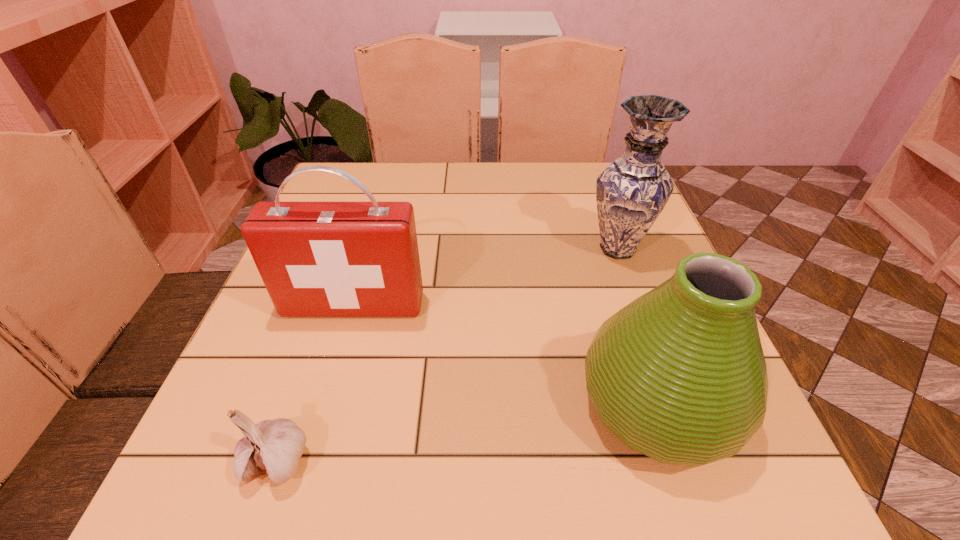
I want to click on the first-aid kit at the left edge, so click(317, 259).

Where is `garlic at the left edge`? The width and height of the screenshot is (960, 540). garlic at the left edge is located at coordinates (274, 447).

This screenshot has height=540, width=960. Identify the location of object situated at the near left corner. (274, 447).

Where is `object that is at the near right corner`? This screenshot has height=540, width=960. object that is at the near right corner is located at coordinates (679, 374).

In the image, there is a desktop. What are the coordinates of `vacant space at the far edge` in the screenshot? It's located at (394, 168).

You are a GUI agent. You are given a task and a screenshot of the screen. Output one action in this format:
    pyautogui.click(x=<x>, y=<y>)
    Task: Click on the vacant space at the near edge of the desktop
    
    Given the screenshot: What is the action you would take?
    pyautogui.click(x=406, y=452)

Where is `vacant space at the left edge of the desktop`? The width and height of the screenshot is (960, 540). vacant space at the left edge of the desktop is located at coordinates (300, 376).

The image size is (960, 540). Identify the location of free location at the right edge of the desktop. (657, 233).

This screenshot has height=540, width=960. I want to click on free spot at the near left corner of the desktop, so click(x=206, y=505).

Locate an element on the screen. The image size is (960, 540). vacant space that's between the farthest object and the shortest object is located at coordinates (447, 354).